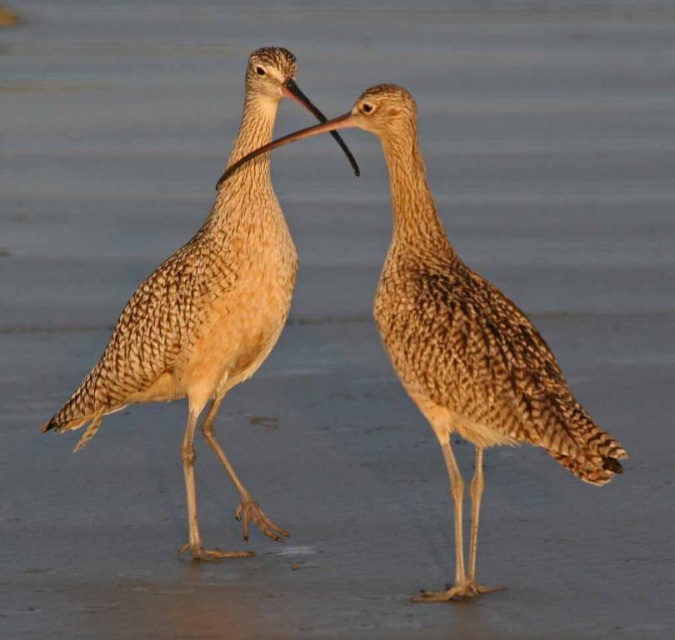
Who is shorter, brown speckled feathers at center or speckled feathered shorebird at center?

Standing shorter between the two is brown speckled feathers at center.

Does brown speckled feathers at center have a larger size compared to speckled feathered shorebird at center?

Yes, brown speckled feathers at center is bigger than speckled feathered shorebird at center.

Which is in front, point (475, 320) or point (184, 460)?

Point (475, 320) is more forward.

At what (x,y) coordinates should I click in order to perform the action: click on brown speckled feathers at center. Please return your answer as a coordinate pair (x, y). This screenshot has width=675, height=640. Looking at the image, I should click on (459, 337).